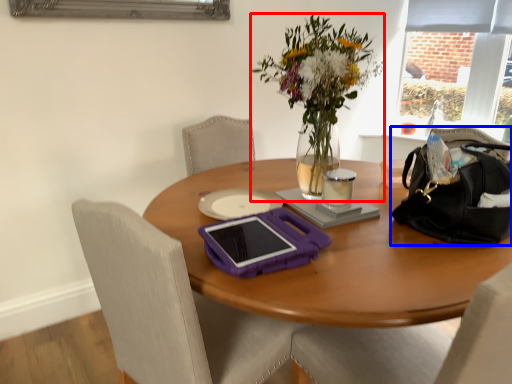
Question: Which object is closer to the camera taking this photo, flower (highlighted by a red box) or handbag (highlighted by a blue box)?

Choices:
 (A) flower
 (B) handbag

Answer: (A)